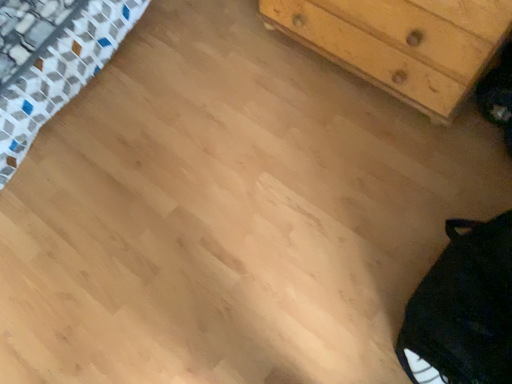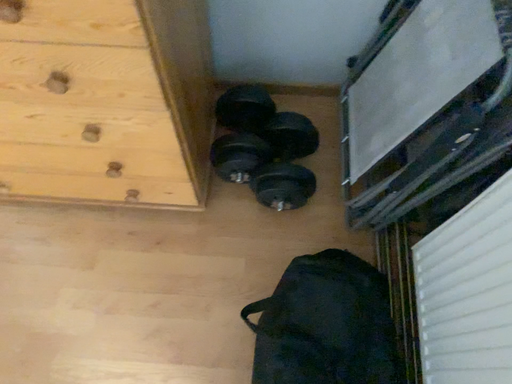
Question: Which way did the camera rotate in the video?

Choices:
 (A) rotated left
 (B) rotated right

Answer: (B)